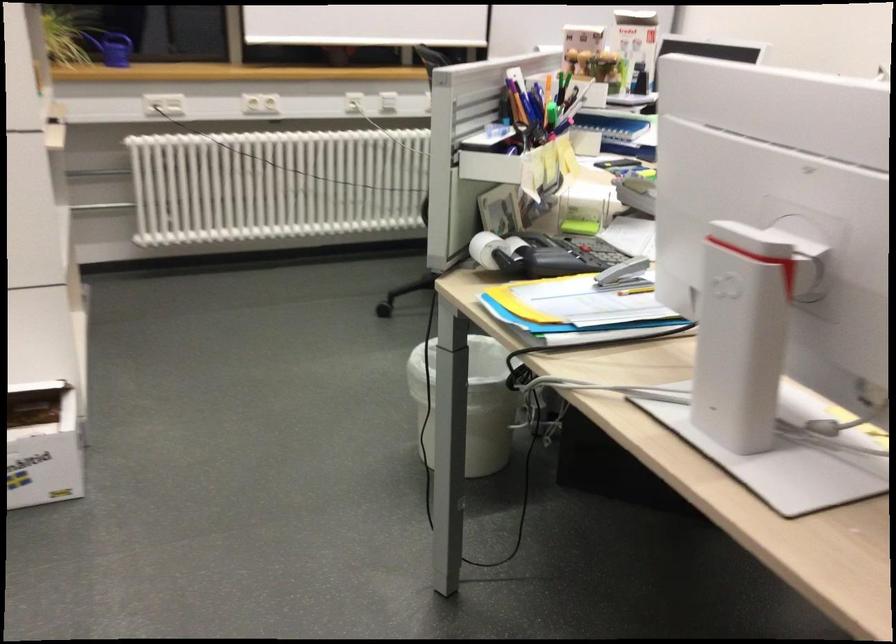
The width and height of the screenshot is (896, 644). What are the coordinates of `telephone handset` in the screenshot? It's located at (554, 259).